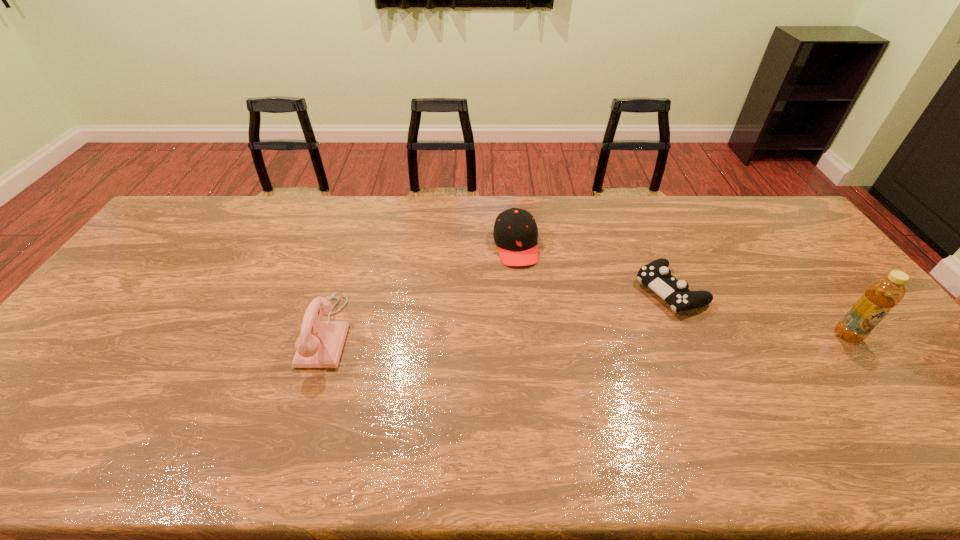
The image size is (960, 540). I want to click on free region at the far edge, so click(x=259, y=214).

You are a GUI agent. You are given a task and a screenshot of the screen. Output one action in this format:
    pyautogui.click(x=<x>, y=<y>)
    Task: Click on the vacant area at the near edge of the desktop
    
    Given the screenshot: What is the action you would take?
    pyautogui.click(x=690, y=394)

This screenshot has height=540, width=960. In the image, there is a desktop. What are the coordinates of `vacant space at the left edge` in the screenshot? It's located at (95, 312).

The image size is (960, 540). In the image, there is a desktop. In order to click on vacant space at the right edge in this screenshot , I will do `click(825, 323)`.

Where is `empty space between the second tallest object and the control`? This screenshot has width=960, height=540. empty space between the second tallest object and the control is located at coordinates (498, 311).

The width and height of the screenshot is (960, 540). Identify the location of vacant space in between the rightmost object and the third object from left to right. (758, 313).

Find the location of a particular element. The image size is (960, 540). free area in between the telephone and the cap is located at coordinates (421, 289).

Identify the location of vacant region between the third tallest object and the shortest object. The image size is (960, 540). (592, 268).

Find the location of `vacant space that is in between the bottle and the third object from left to right`. vacant space that is in between the bottle and the third object from left to right is located at coordinates (758, 313).

This screenshot has height=540, width=960. I want to click on blank region between the third object from left to right and the second shortest object, so click(x=592, y=268).